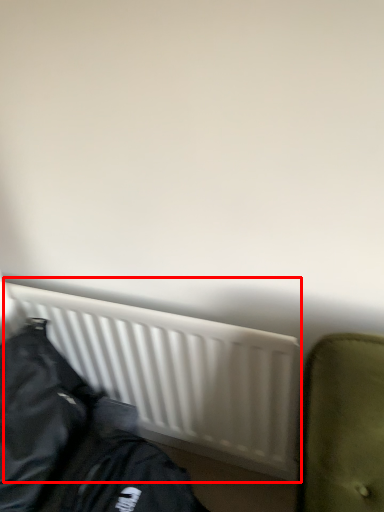
Question: From the image, what is the correct spatial relationship of radiator (annotated by the red box) in relation to jacket?

Choices:
 (A) right
 (B) left

Answer: (A)